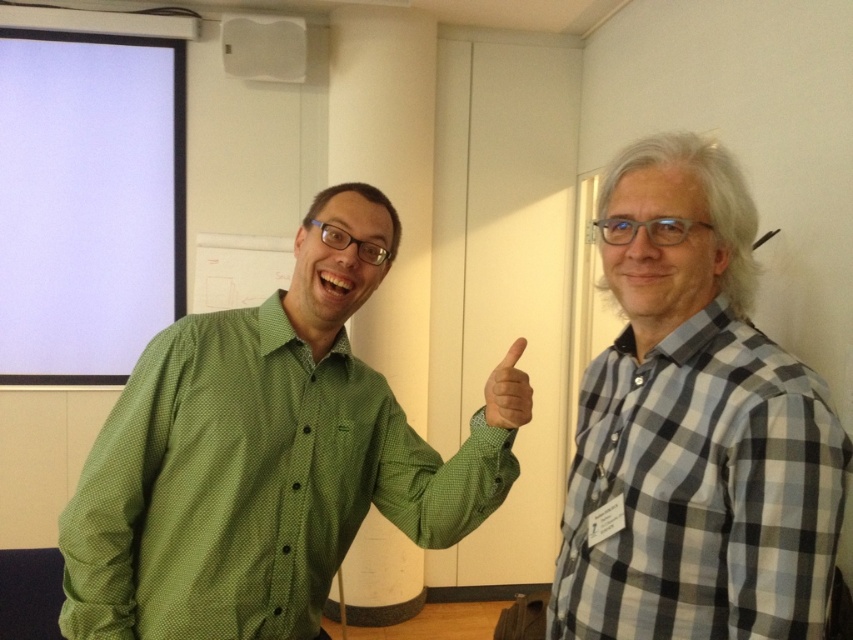
Question: Does gray checkered shirt at right have a smaller size compared to green matte hand at center?

Choices:
 (A) no
 (B) yes

Answer: (A)

Question: Does gray checkered shirt at right lie behind green matte hand at center?

Choices:
 (A) no
 (B) yes

Answer: (A)

Question: Considering the real-world distances, which object is closest to the gray checkered shirt at right?

Choices:
 (A) green dotted shirt at left
 (B) green matte hand at center

Answer: (B)

Question: Which point is closer to the camera taking this photo?

Choices:
 (A) [x=750, y=348]
 (B) [x=78, y=509]

Answer: (A)

Question: Which object is farther from the camera taking this photo?

Choices:
 (A) green dotted shirt at left
 (B) gray checkered shirt at right

Answer: (A)

Question: Can you confirm if gray checkered shirt at right is positioned to the left of green matte hand at center?

Choices:
 (A) yes
 (B) no

Answer: (B)